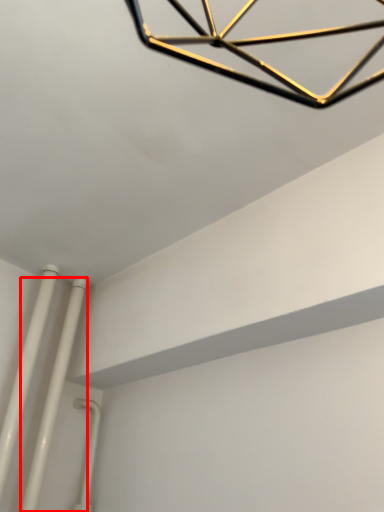
Question: From the image's perspective, considering the relative positions of pipe (annotated by the red box) and pipe in the image provided, where is pipe (annotated by the red box) located with respect to the staircase?

Choices:
 (A) above
 (B) below

Answer: (B)